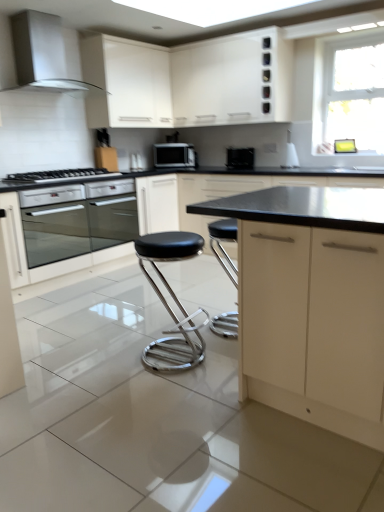
Question: Which direction should I rotate to look at black matte cabinet at center, marked as the 3th cabinetry in a top-to-bottom arrangement?

Choices:
 (A) left
 (B) right

Answer: (B)

Question: Is satin silver oven at lower left smaller than matte cream cabinet at center, the 1th cabinetry positioned from the bottom?

Choices:
 (A) no
 (B) yes

Answer: (B)

Question: Can you confirm if satin silver oven at lower left is wider than matte cream cabinet at center, acting as the fourth cabinetry starting from the top?

Choices:
 (A) no
 (B) yes

Answer: (A)

Question: Is satin silver oven at lower left at the left side of matte cream cabinet at center, the 1th cabinetry positioned from the bottom?

Choices:
 (A) yes
 (B) no

Answer: (A)

Question: Does satin silver oven at lower left have a lesser width compared to matte cream cabinet at center, the 1th cabinetry positioned from the bottom?

Choices:
 (A) no
 (B) yes

Answer: (B)

Question: Can you confirm if satin silver oven at lower left is shorter than matte cream cabinet at center, acting as the fourth cabinetry starting from the top?

Choices:
 (A) yes
 (B) no

Answer: (A)

Question: From a real-world perspective, is satin silver oven at lower left on matte cream cabinet at center, the 1th cabinetry positioned from the bottom?

Choices:
 (A) no
 (B) yes

Answer: (B)

Question: Does black leather stool at center have a lesser width compared to white matte cabinet at upper center, the 3th cabinetry positioned from the bottom?

Choices:
 (A) yes
 (B) no

Answer: (B)

Question: Does black leather stool at center appear on the left side of white matte cabinet at upper center, the 3th cabinetry positioned from the bottom?

Choices:
 (A) yes
 (B) no

Answer: (B)

Question: Could you tell me if black leather stool at center is facing white matte cabinet at upper center, which ranks as the second cabinetry in top-to-bottom order?

Choices:
 (A) yes
 (B) no

Answer: (B)

Question: Does black leather stool at center lie in front of white matte cabinet at upper center, the 3th cabinetry positioned from the bottom?

Choices:
 (A) yes
 (B) no

Answer: (A)

Question: Is black leather stool at center outside of white matte cabinet at upper center, the 3th cabinetry positioned from the bottom?

Choices:
 (A) no
 (B) yes

Answer: (B)

Question: Can you confirm if black leather stool at center is bigger than white matte cabinet at upper center, the 3th cabinetry positioned from the bottom?

Choices:
 (A) yes
 (B) no

Answer: (B)

Question: Is satin silver oven at lower left a part of black glossy toaster at center?

Choices:
 (A) no
 (B) yes

Answer: (A)